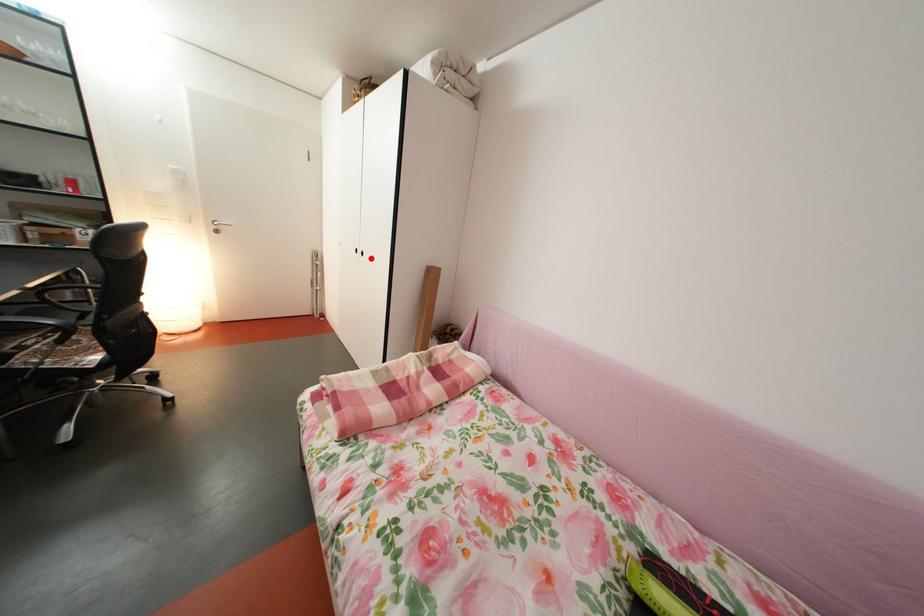
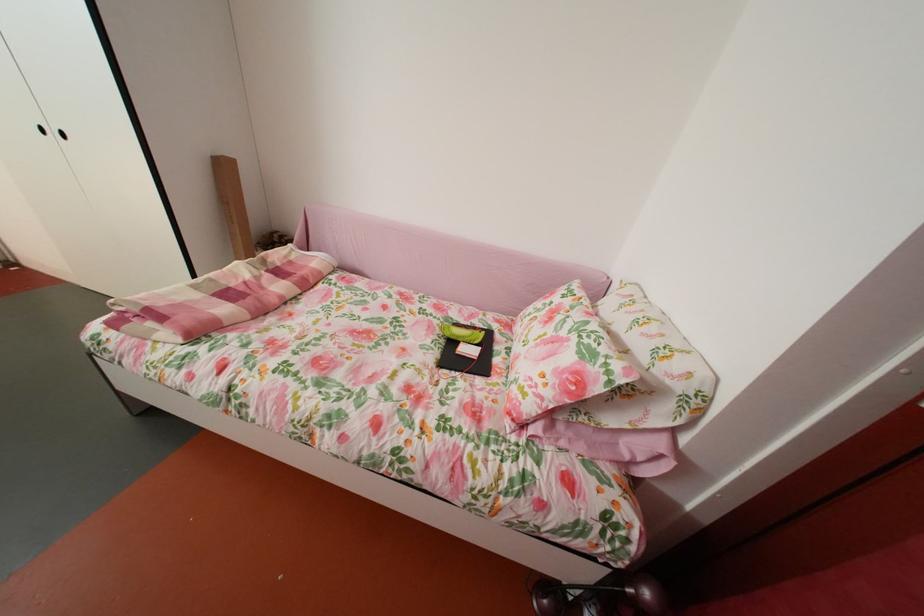
In the second image, find the point that corresponds to the highlighted location in the first image.

(65, 139)